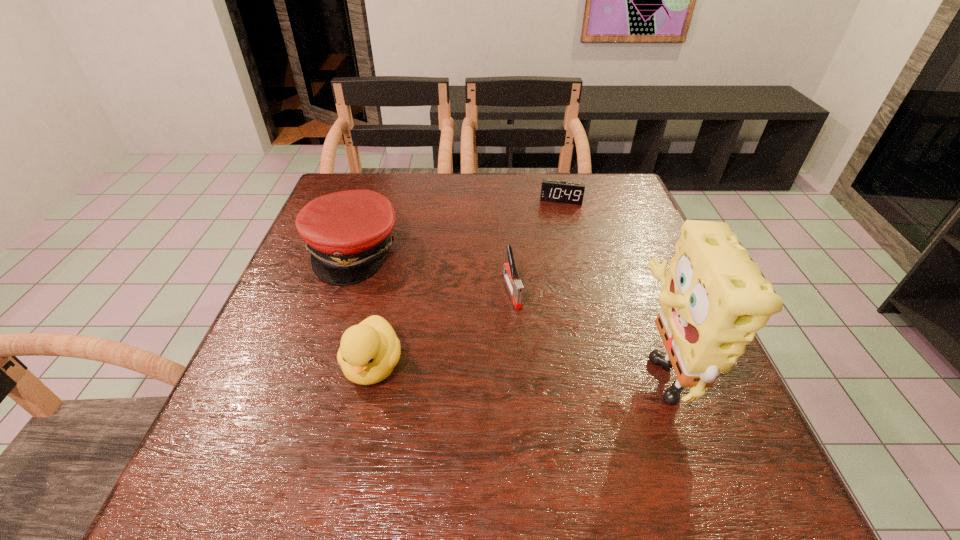
At what (x,y) coordinates should I click in order to perform the action: click on free location at the right edge of the desktop. Please return your answer as a coordinate pair (x, y). Looking at the image, I should click on (611, 246).

Image resolution: width=960 pixels, height=540 pixels. In the image, there is a desktop. In order to click on vacant space at the near left corner in this screenshot , I will do `click(252, 395)`.

Where is `vacant space at the far right corner of the desktop`? This screenshot has height=540, width=960. vacant space at the far right corner of the desktop is located at coordinates (629, 204).

Locate an element on the screen. Image resolution: width=960 pixels, height=540 pixels. free space at the near right corner of the desktop is located at coordinates (733, 407).

Where is `free point between the stapler and the farthest object`? The image size is (960, 540). free point between the stapler and the farthest object is located at coordinates (537, 245).

Locate an element on the screen. unoccupied area between the shortest object and the sponge is located at coordinates (609, 284).

The image size is (960, 540). I want to click on free space between the duck and the farthest object, so click(x=468, y=283).

The width and height of the screenshot is (960, 540). Identify the location of vacant area between the tallest object and the stapler. (584, 329).

Image resolution: width=960 pixels, height=540 pixels. I want to click on empty space between the cap and the alarm clock, so click(x=457, y=226).

Locate an element on the screen. Image resolution: width=960 pixels, height=540 pixels. blank region between the cap and the duck is located at coordinates (363, 309).